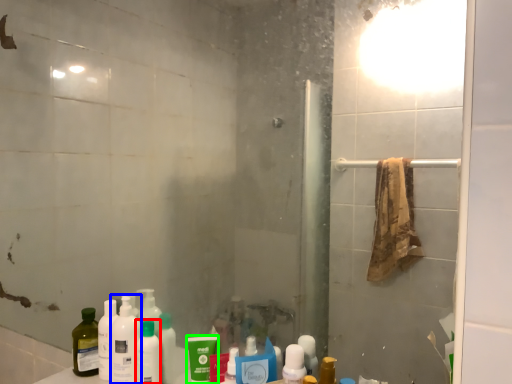
Question: Based on their relative distances, which object is nearer to toiletry (highlighted by a red box)? Choose from cleaning product (highlighted by a blue box) and mouthwash (highlighted by a green box).

Choices:
 (A) cleaning product
 (B) mouthwash

Answer: (A)